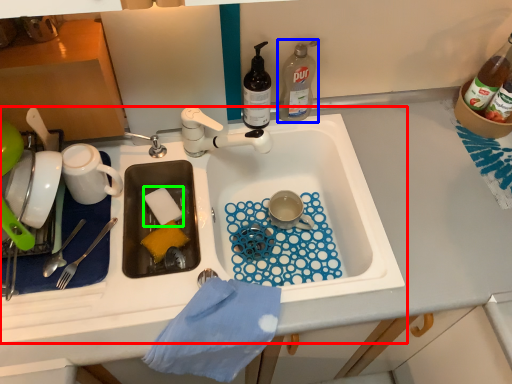
Question: Which object is positioned farthest from sink (highlighted by a red box)? Select from bottle (highlighted by a blue box) and food (highlighted by a green box).

Choices:
 (A) bottle
 (B) food

Answer: (B)